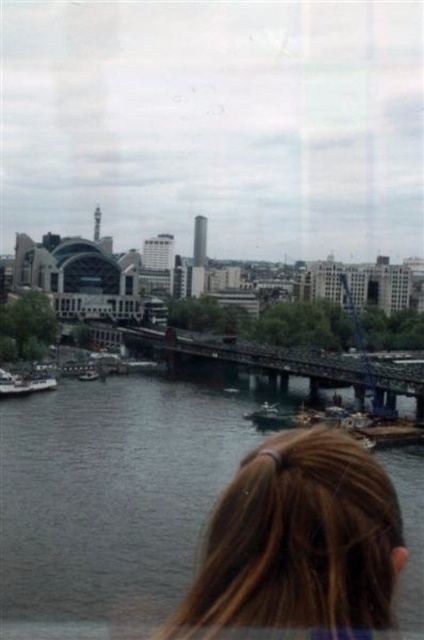
You are a photographer trying to capture the entire scene of the cityscape by the river. You notice the dark gray water at center and the brown hair at lower center in your viewfinder. Which object would you need to adjust your focus on to ensure both are in frame, considering their sizes?

The dark gray water at center is larger in size than the brown hair at lower center, so you should adjust your focus on the dark gray water at center to ensure both fit within the frame.

You are standing at the point with coordinates (108,500) in the cityscape by the river. What do you see directly in front of you?

At point (108,500), you see dark gray water at center directly in front of you.

In the scene shown: You are a photographer standing at the riverbank and want to capture a photo of the dark gray water at center and the white matte boat at lower left. Based on their positions, which object should you focus on first to ensure both are in the frame?

The dark gray water at center is below the white matte boat at lower left, so you should focus on the white matte boat at lower left first to ensure both are in the frame.